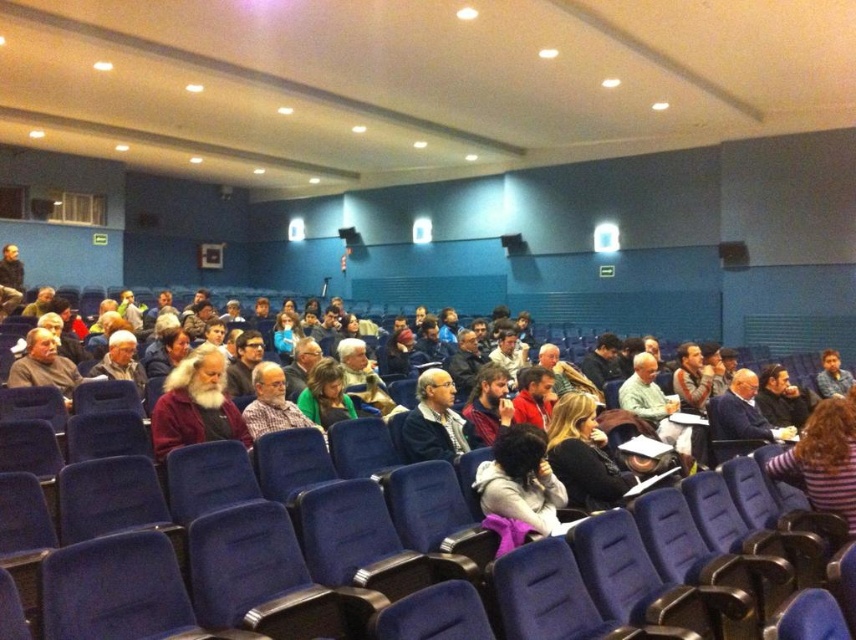
You are sitting in the auditorium and notice two people in the row directly in front of you. One is wearing a gray wool sweater at center, and the other has light brown hair at center. Based on their positions, which person is sitting to your left?

The gray wool sweater at center is to the left of light brown hair at center, so the person wearing the gray wool sweater at center is sitting to your left.

You are standing at the entrance of the auditorium and see the point marked at coordinate (520, 481). What object is located at that point?

The point at coordinate (520, 481) is located on the dark purple sweater at center.

You are standing at the entrance of the auditorium and want to locate the gray wool sweater at center. According to the coordinates provided, in which direction should you look relative to the center of the image?

The gray wool sweater at center is located at coordinates point (435, 420). Since the x coordinate is greater than 0.5, it is to the right of the center. The y coordinate is 0.509, which is just slightly above the center. So you should look to the right and slightly above the center of the image.